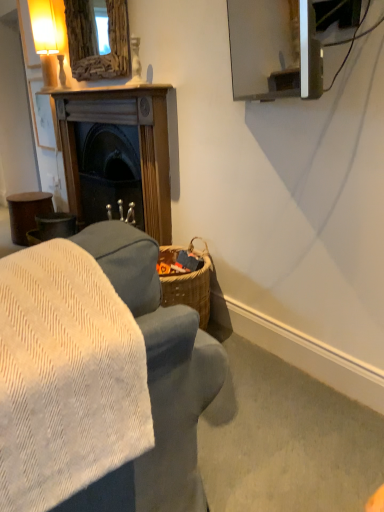
Question: From a real-world perspective, is wooden mirror at upper center physically below velvet gray couch at lower left?

Choices:
 (A) yes
 (B) no

Answer: (B)

Question: Is wooden mirror at upper center placed right next to velvet gray couch at lower left?

Choices:
 (A) no
 (B) yes

Answer: (A)

Question: Could you tell me if wooden mirror at upper center is facing velvet gray couch at lower left?

Choices:
 (A) no
 (B) yes

Answer: (A)

Question: Is wooden mirror at upper center at the left side of velvet gray couch at lower left?

Choices:
 (A) no
 (B) yes

Answer: (A)

Question: Is wooden mirror at upper center positioned in front of velvet gray couch at lower left?

Choices:
 (A) no
 (B) yes

Answer: (A)

Question: Is wooden mirror at upper center smaller than velvet gray couch at lower left?

Choices:
 (A) no
 (B) yes

Answer: (B)

Question: Does matte glass table lamp at upper left have a larger size compared to wooden fireplace at left?

Choices:
 (A) no
 (B) yes

Answer: (A)

Question: Is matte glass table lamp at upper left positioned far away from wooden fireplace at left?

Choices:
 (A) yes
 (B) no

Answer: (B)

Question: Can you confirm if matte glass table lamp at upper left is positioned to the right of wooden fireplace at left?

Choices:
 (A) no
 (B) yes

Answer: (A)

Question: From the image's perspective, is matte glass table lamp at upper left under wooden fireplace at left?

Choices:
 (A) yes
 (B) no

Answer: (B)

Question: Could you tell me if matte glass table lamp at upper left is turned towards wooden fireplace at left?

Choices:
 (A) no
 (B) yes

Answer: (A)

Question: Is matte glass table lamp at upper left taller than wooden fireplace at left?

Choices:
 (A) no
 (B) yes

Answer: (A)

Question: Considering the relative sizes of wooden fireplace at left and velvet gray couch at lower left in the image provided, is wooden fireplace at left smaller than velvet gray couch at lower left?

Choices:
 (A) no
 (B) yes

Answer: (A)